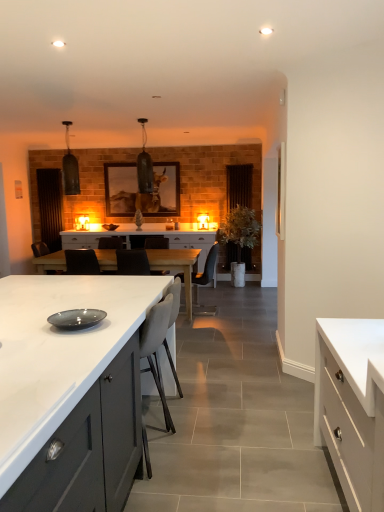
Question: Is white matte cabinet at center, arranged as the third cabinetry when viewed from the right, far away from beige fabric armchair at center, marked as the 1th armchair in a front-to-back arrangement?

Choices:
 (A) no
 (B) yes

Answer: (A)

Question: Is beige fabric armchair at center, marked as the 1th armchair in a front-to-back arrangement, surrounded by white matte cabinet at center, which is the third cabinetry from back to front?

Choices:
 (A) no
 (B) yes

Answer: (B)

Question: Can you confirm if white matte cabinet at center, acting as the 1th cabinetry starting from the left, is taller than beige fabric armchair at center, marked as the second armchair in a back-to-front arrangement?

Choices:
 (A) yes
 (B) no

Answer: (A)

Question: Is white matte cabinet at center, the 1th cabinetry when ordered from front to back, oriented away from beige fabric armchair at center, marked as the 1th armchair in a front-to-back arrangement?

Choices:
 (A) yes
 (B) no

Answer: (B)

Question: From the image's perspective, does white matte cabinet at center, arranged as the third cabinetry when viewed from the right, appear higher than beige fabric armchair at center, marked as the 1th armchair in a front-to-back arrangement?

Choices:
 (A) yes
 (B) no

Answer: (B)

Question: From the image's perspective, would you say white matte cabinet at center, acting as the 1th cabinetry starting from the left, is shown under beige fabric armchair at center, marked as the second armchair in a back-to-front arrangement?

Choices:
 (A) yes
 (B) no

Answer: (A)

Question: Does brown wooden door at left, the 1th glass door in the left-to-right sequence, turn towards beige fabric armchair at center, marked as the 1th armchair in a front-to-back arrangement?

Choices:
 (A) yes
 (B) no

Answer: (B)

Question: Considering the relative sizes of brown wooden door at left, the 1th glass door in the left-to-right sequence, and beige fabric armchair at center, marked as the second armchair in a back-to-front arrangement, in the image provided, is brown wooden door at left, the 1th glass door in the left-to-right sequence, thinner than beige fabric armchair at center, marked as the second armchair in a back-to-front arrangement,?

Choices:
 (A) yes
 (B) no

Answer: (A)

Question: Is brown wooden door at left, acting as the 2th glass door starting from the right, touching beige fabric armchair at center, marked as the second armchair in a back-to-front arrangement?

Choices:
 (A) no
 (B) yes

Answer: (A)

Question: From a real-world perspective, is brown wooden door at left, acting as the 2th glass door starting from the right, over beige fabric armchair at center, marked as the second armchair in a back-to-front arrangement?

Choices:
 (A) yes
 (B) no

Answer: (A)

Question: Does brown wooden door at left, acting as the 2th glass door starting from the right, have a greater width compared to beige fabric armchair at center, marked as the 1th armchair in a front-to-back arrangement?

Choices:
 (A) no
 (B) yes

Answer: (A)

Question: Does brown wooden door at left, the 1th glass door in the left-to-right sequence, appear on the left side of beige fabric armchair at center, marked as the 1th armchair in a front-to-back arrangement?

Choices:
 (A) no
 (B) yes

Answer: (B)

Question: Does white matte cabinet at right, the 2th cabinetry from the front, come in front of transparent glass door at center, which appears as the first glass door when viewed from the right?

Choices:
 (A) yes
 (B) no

Answer: (A)